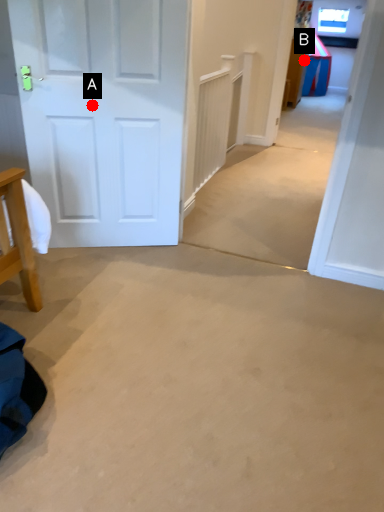
Question: Two points are circled on the image, labeled by A and B beside each circle. Which point appears farthest from the camera in this image?

Choices:
 (A) A is further
 (B) B is further

Answer: (B)